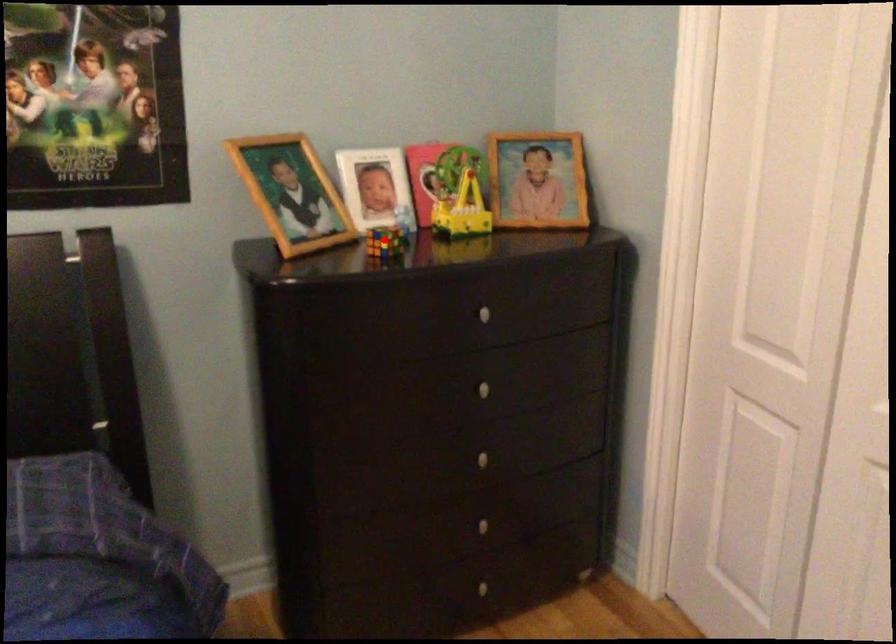
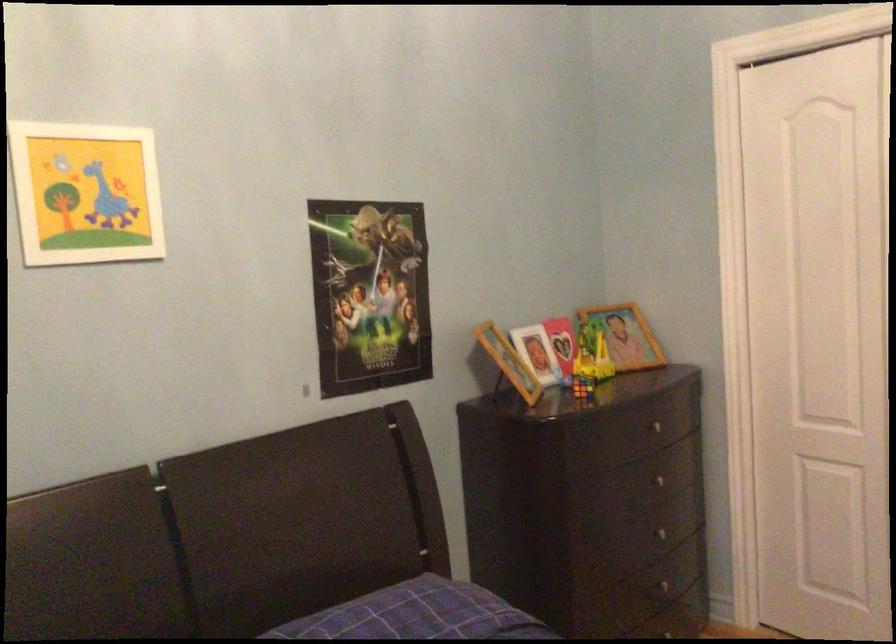
Question: I am providing you with two images of the same scene from different viewpoints. Given a red point in image1, look at the same physical point in image2. Is it:

Choices:
 (A) Closer to the viewpoint
 (B) Farther from the viewpoint

Answer: (B)